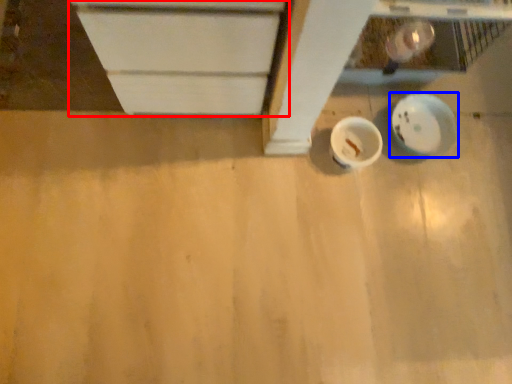
Question: Which object is further to the camera taking this photo, cabinetry (highlighted by a red box) or plate (highlighted by a blue box)?

Choices:
 (A) cabinetry
 (B) plate

Answer: (B)